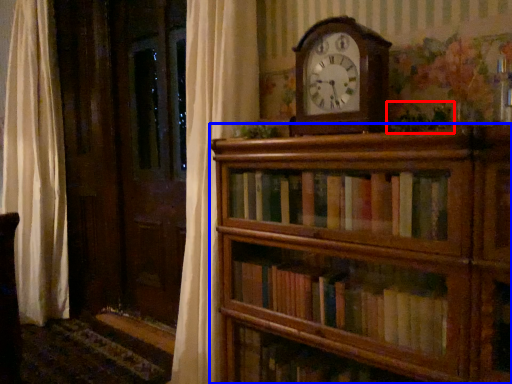
Question: Among these objects, which one is farthest to the camera, plant (highlighted by a red box) or shelf (highlighted by a blue box)?

Choices:
 (A) plant
 (B) shelf

Answer: (A)